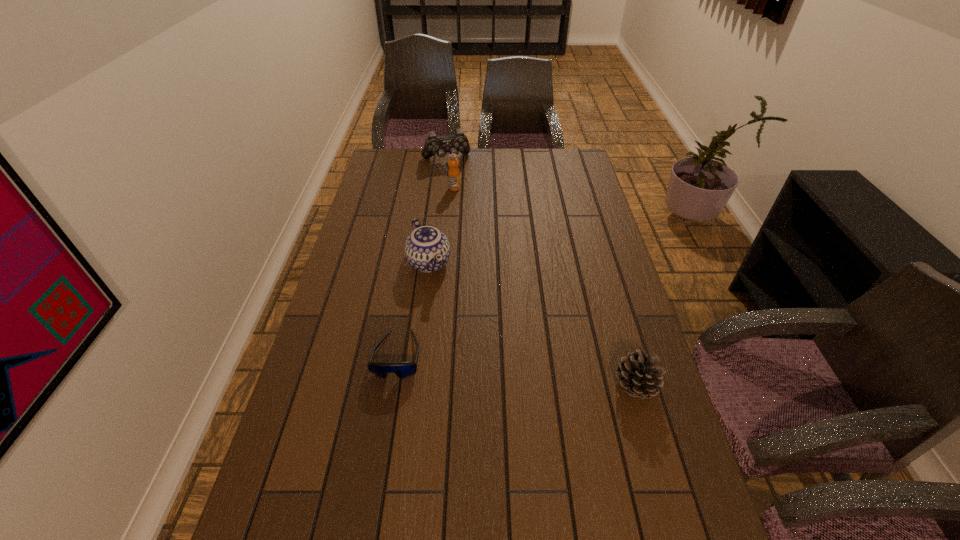
At what (x,y) coordinates should I click in order to perform the action: click on vacant area that lies between the rightmost object and the shortest object. Please return your answer as a coordinate pair (x, y). This screenshot has height=540, width=960. Looking at the image, I should click on point(516,371).

The height and width of the screenshot is (540, 960). Identify the location of empty space that is in between the chinaware and the farthest object. (438, 211).

Point out which object is positioned as the nearest to the farthest object. Please provide its 2D coordinates. Your answer should be formatted as a tuple, i.e. [(x, y)], where the tuple contains the x and y coordinates of a point satisfying the conditions above.

[(453, 173)]

Locate which object ranks fourth in proximity to the rightmost object. Please provide its 2D coordinates. Your answer should be formatted as a tuple, i.e. [(x, y)], where the tuple contains the x and y coordinates of a point satisfying the conditions above.

[(453, 144)]